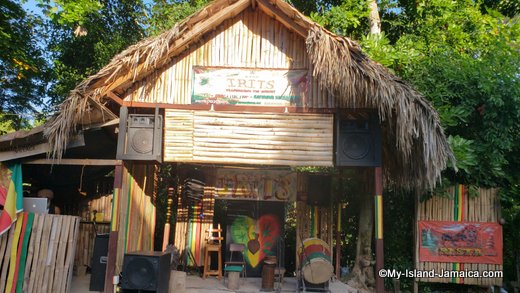
Identify the location of stool. (234, 273).